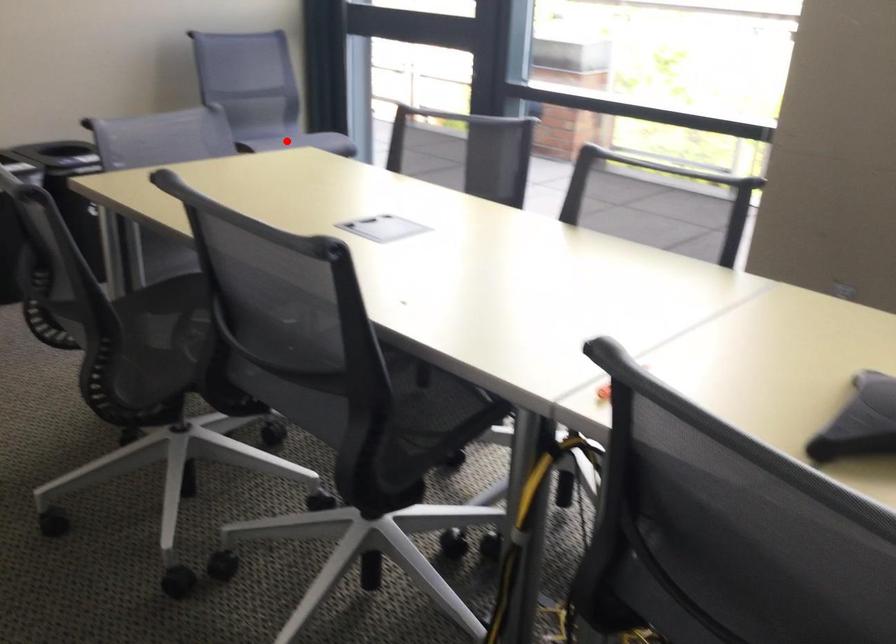
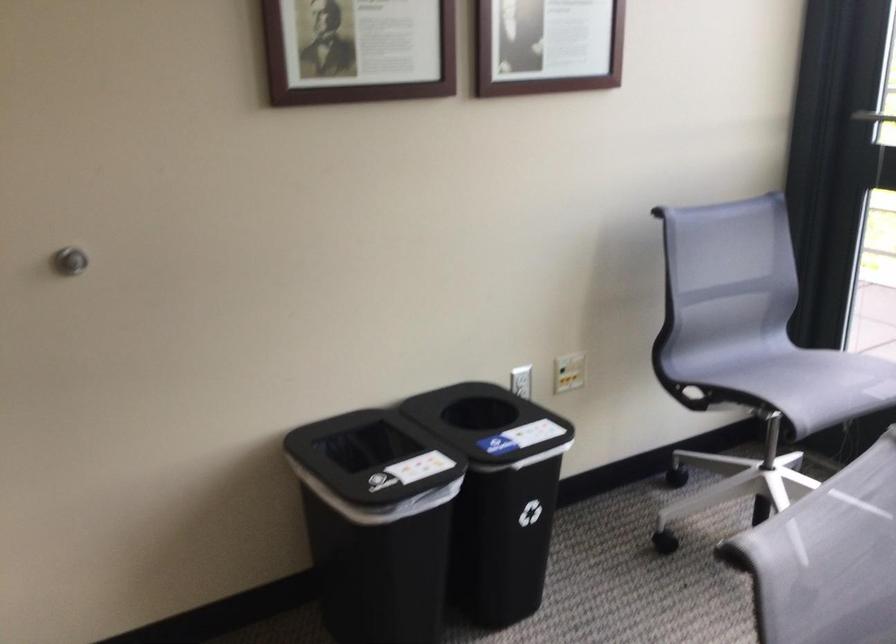
In the second image, find the point that corresponds to the highlighted location in the first image.

(812, 382)